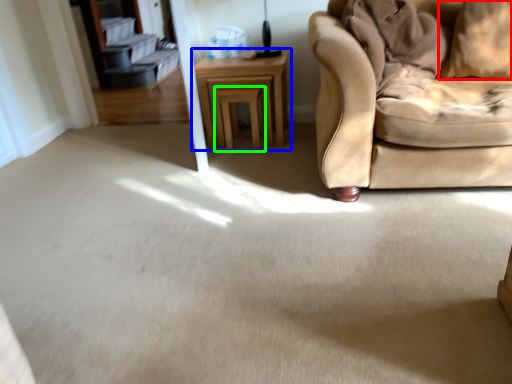
Question: Which object is positioned farthest from pillow (highlighted by a red box)? Select from table (highlighted by a blue box) and stool (highlighted by a green box).

Choices:
 (A) table
 (B) stool

Answer: (B)